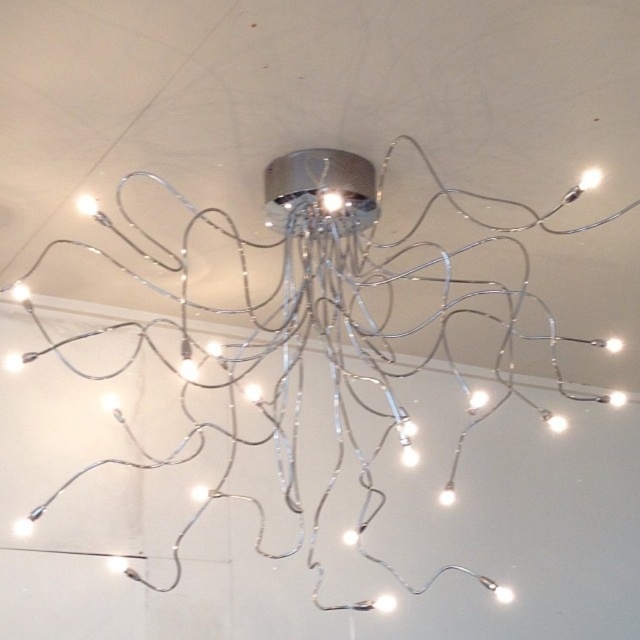
Based on the photo, does metallic wire chandelier at center appear over white glossy light at center?

Yes.

Identify the location of metallic wire chandelier at center. (314, 336).

Which of these two, metallic wire chandelier at center or white glossy light at upper right, stands taller?

metallic wire chandelier at center is taller.

Is metallic wire chandelier at center thinner than white glossy light at upper right?

In fact, metallic wire chandelier at center might be wider than white glossy light at upper right.

The image size is (640, 640). Identify the location of metallic wire chandelier at center. (314, 336).

Does matte silver wire at upper left appear on the right side of white glossy light bulb at center?

In fact, matte silver wire at upper left is to the left of white glossy light bulb at center.

Consider the image. Between matte silver wire at upper left and white glossy light bulb at center, which one appears on the right side from the viewer's perspective?

Positioned to the right is white glossy light bulb at center.

The image size is (640, 640). What do you see at coordinates (88, 204) in the screenshot?
I see `matte silver wire at upper left` at bounding box center [88, 204].

Image resolution: width=640 pixels, height=640 pixels. Find the location of `matte silver wire at upper left`. matte silver wire at upper left is located at coordinates (88, 204).